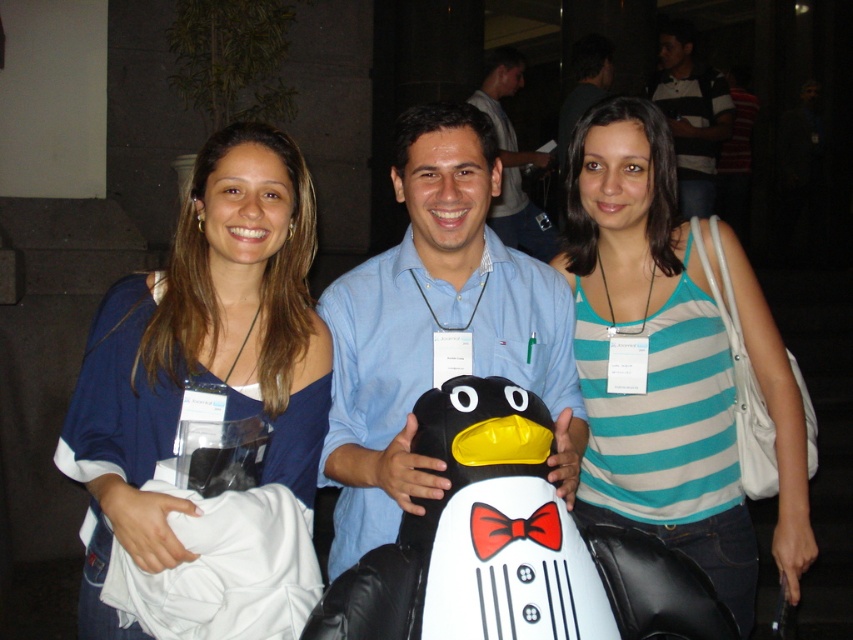
Question: Is teal striped tank top at center in front of striped cotton shirt at upper right?

Choices:
 (A) no
 (B) yes

Answer: (B)

Question: Among these points, which one is nearest to the camera?

Choices:
 (A) (109, 378)
 (B) (682, 264)
 (C) (521, 163)

Answer: (A)

Question: In this image, where is teal striped tank top at center located relative to blue fabric shirt at upper left?

Choices:
 (A) right
 (B) left

Answer: (A)

Question: Estimate the real-world distances between objects in this image. Which object is closer to the matte blue shirt at center?

Choices:
 (A) teal striped tank top at center
 (B) blue fabric shirt at upper left

Answer: (A)

Question: Among these points, which one is nearest to the camera?

Choices:
 (A) (125, 497)
 (B) (515, 60)
 (C) (656, 99)

Answer: (A)

Question: Can you confirm if blue fabric shirt at center is positioned below striped cotton shirt at upper right?

Choices:
 (A) no
 (B) yes

Answer: (B)